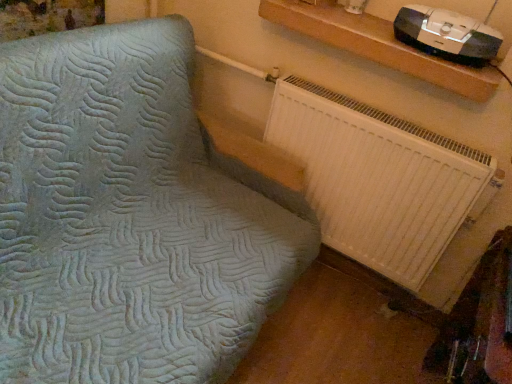
Where is `free space underneath white plastic radiator at lower right (from a real-world perspective)`? The height and width of the screenshot is (384, 512). free space underneath white plastic radiator at lower right (from a real-world perspective) is located at coordinates (348, 283).